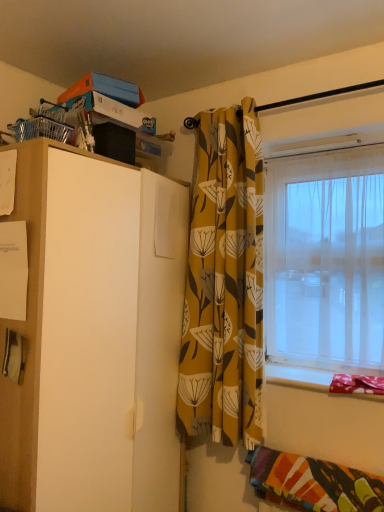
Question: From the image's perspective, is multicolored woven blanket at lower right above or below white matte cabinet at left?

Choices:
 (A) above
 (B) below

Answer: (B)

Question: In terms of height, does multicolored woven blanket at lower right look taller or shorter compared to white matte cabinet at left?

Choices:
 (A) tall
 (B) short

Answer: (B)

Question: Which object is the closest to the yellow floral fabric curtain at center?

Choices:
 (A) fabric covered window sill at lower right
 (B) white matte cabinet at left
 (C) multicolored woven blanket at lower right
 (D) transparent plastic window at right

Answer: (D)

Question: Which object is positioned closest to the yellow floral fabric curtain at center?

Choices:
 (A) multicolored woven blanket at lower right
 (B) white matte cabinet at left
 (C) transparent plastic window at right
 (D) fabric covered window sill at lower right

Answer: (C)